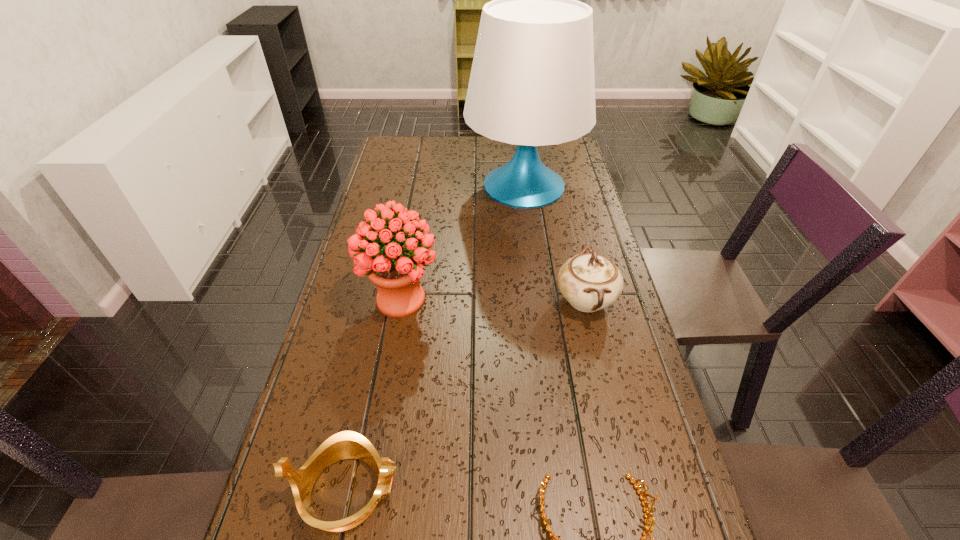
The width and height of the screenshot is (960, 540). I want to click on object that is at the left edge, so (x=396, y=269).

This screenshot has width=960, height=540. Find the location of `table lamp that is at the right edge`. table lamp that is at the right edge is located at coordinates (532, 83).

Locate an element on the screen. This screenshot has height=540, width=960. chinaware at the right edge is located at coordinates (590, 282).

The width and height of the screenshot is (960, 540). In order to click on object located in the far right corner section of the desktop in this screenshot , I will do `click(532, 83)`.

This screenshot has height=540, width=960. Identify the location of free space at the far edge of the desktop. (479, 150).

Locate an element on the screen. vacant area at the left edge of the desktop is located at coordinates (420, 181).

Identify the location of free region at the right edge of the desktop. (693, 531).

Where is `vacant space at the far left corner`? The width and height of the screenshot is (960, 540). vacant space at the far left corner is located at coordinates (399, 137).

This screenshot has width=960, height=540. What are the coordinates of `empty space that is in between the farthest object and the chinaware` in the screenshot? It's located at [x=555, y=242].

Image resolution: width=960 pixels, height=540 pixels. I want to click on vacant area that lies between the bouquet and the third shortest object, so click(493, 299).